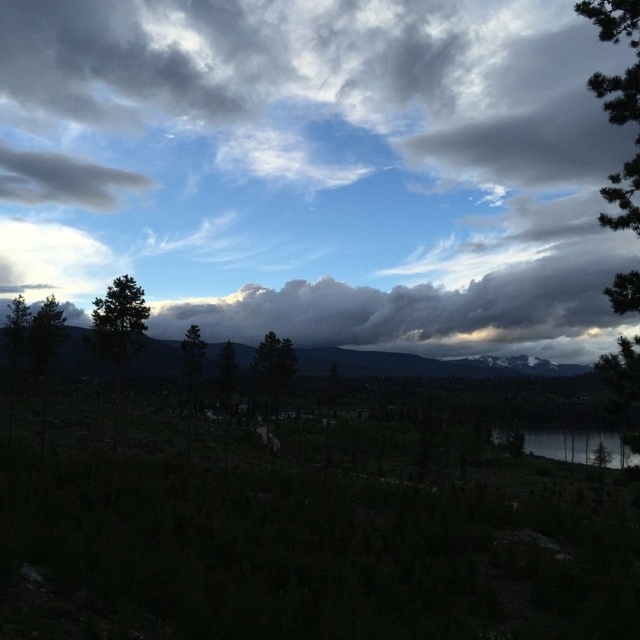
You are an observer standing on the edge of the water in the image. Which object, the cloudy sky at upper center or the smooth reflective water at lower right, is located to your left when facing the water?

The cloudy sky at upper center is located to your left side when facing the water because it is positioned on the left side of the smooth reflective water at lower right.

You are an environmental scientist assessing the landscape. You observe the dark gray rocky mountain at center and the green matte tree at center. Which object would cast a longer shadow during the late afternoon sun? Please base your answer on their relative heights.

The dark gray rocky mountain at center has a greater height compared to the green matte tree at center, so it would cast a longer shadow during the late afternoon sun.